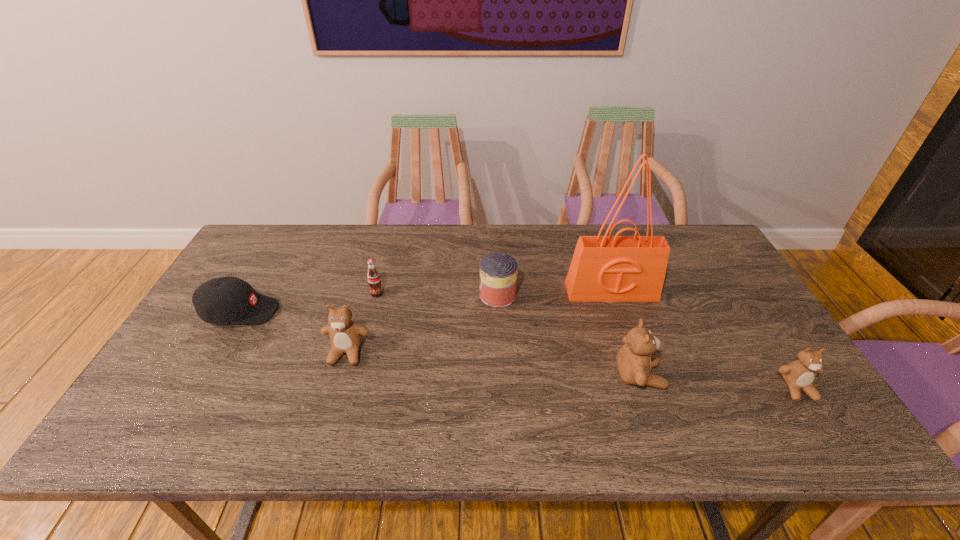
Locate an element on the screen. This screenshot has width=960, height=540. vacant position located 0.140m on the front-facing side of the second teddy bear from right to left is located at coordinates (719, 376).

Locate an element on the screen. vacant position located 0.220m on the back of the fourth object from right to left is located at coordinates (495, 240).

Where is `free space located 0.330m on the logo side of the tallest object`? Image resolution: width=960 pixels, height=540 pixels. free space located 0.330m on the logo side of the tallest object is located at coordinates (647, 401).

Locate an element on the screen. This screenshot has height=540, width=960. free space located with a logo on the front of the leftmost object is located at coordinates coord(386,312).

At what (x,y) coordinates should I click in order to perform the action: click on vacant space situated on the left of the soda. Please return your answer as a coordinate pair (x, y). Image resolution: width=960 pixels, height=540 pixels. Looking at the image, I should click on 330,293.

Where is `object that is at the left edge`? This screenshot has height=540, width=960. object that is at the left edge is located at coordinates (229, 299).

Where is `object present at the right edge`? This screenshot has width=960, height=540. object present at the right edge is located at coordinates (799, 375).

Locate an element on the screen. object located at the near right corner is located at coordinates (799, 375).

At what (x,y) coordinates should I click in order to perform the action: click on free space at the far edge of the desktop. Please return your answer as a coordinate pair (x, y). This screenshot has height=540, width=960. Looking at the image, I should click on (334, 234).

This screenshot has height=540, width=960. In order to click on vacant space at the near edge of the desktop in this screenshot , I will do (455, 377).